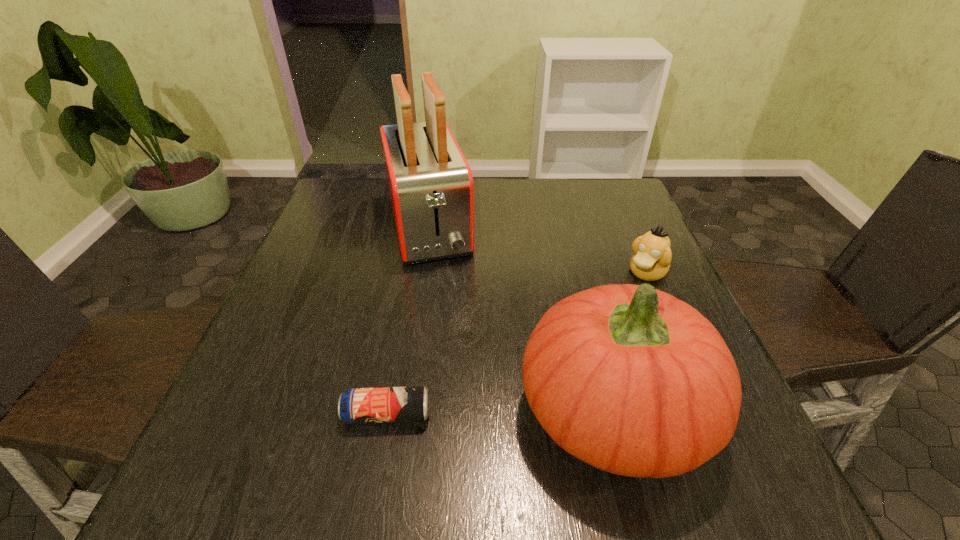
This screenshot has width=960, height=540. I want to click on vacant space in between the pumpkin and the toaster, so click(521, 318).

This screenshot has height=540, width=960. I want to click on free spot between the second shortest object and the beer can, so click(x=517, y=343).

Choose which object is the third nearest neighbor to the second tallest object. Please provide its 2D coordinates. Your answer should be formatted as a tuple, i.e. [(x, y)], where the tuple contains the x and y coordinates of a point satisfying the conditions above.

[(430, 183)]

Locate which object ranks in proximity to the beer can. Please provide its 2D coordinates. Your answer should be formatted as a tuple, i.e. [(x, y)], where the tuple contains the x and y coordinates of a point satisfying the conditions above.

[(627, 378)]

The height and width of the screenshot is (540, 960). I want to click on vacant space that satisfies the following two spatial constraints: 1. on the back side of the pumpkin; 2. on the left side of the beer can, so click(389, 409).